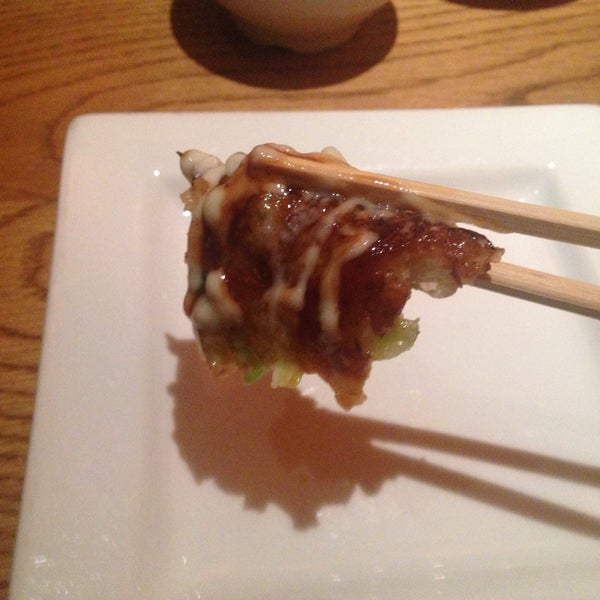
Locate an element on the screen. Image resolution: width=600 pixels, height=600 pixels. wooden table is located at coordinates (85, 84).